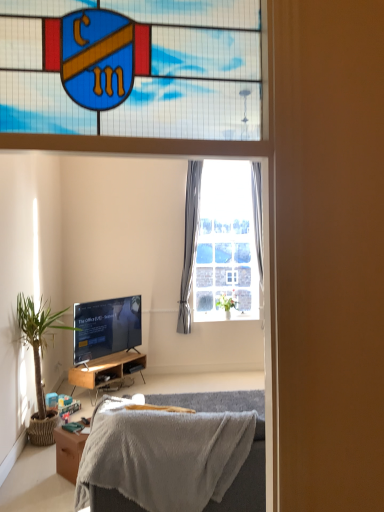
Question: Which direction should I rotate to look at gray fabric curtain at upper center, acting as the first curtain starting from the right, — up or down?

Choices:
 (A) up
 (B) down

Answer: (A)

Question: Is gray fabric curtain at upper center, acting as the first curtain starting from the right, next to matte black tv at lower left?

Choices:
 (A) yes
 (B) no

Answer: (B)

Question: Can you confirm if gray fabric curtain at upper center, the 2th curtain viewed from the left, is taller than matte black tv at lower left?

Choices:
 (A) yes
 (B) no

Answer: (A)

Question: From the image's perspective, is gray fabric curtain at upper center, the 2th curtain viewed from the left, located beneath matte black tv at lower left?

Choices:
 (A) no
 (B) yes

Answer: (A)

Question: Does gray fabric curtain at upper center, the 2th curtain viewed from the left, have a lesser height compared to matte black tv at lower left?

Choices:
 (A) yes
 (B) no

Answer: (B)

Question: Is gray fabric curtain at upper center, acting as the first curtain starting from the right, thinner than matte black tv at lower left?

Choices:
 (A) no
 (B) yes

Answer: (B)

Question: Considering the relative sizes of gray fabric curtain at upper center, the 2th curtain viewed from the left, and matte black tv at lower left in the image provided, is gray fabric curtain at upper center, the 2th curtain viewed from the left, smaller than matte black tv at lower left?

Choices:
 (A) no
 (B) yes

Answer: (B)

Question: Considering the relative sizes of soft gray blanket at lower center and wooden desk at lower left in the image provided, is soft gray blanket at lower center smaller than wooden desk at lower left?

Choices:
 (A) no
 (B) yes

Answer: (A)

Question: Can you confirm if soft gray blanket at lower center is wider than wooden desk at lower left?

Choices:
 (A) no
 (B) yes

Answer: (B)

Question: Is soft gray blanket at lower center far away from wooden desk at lower left?

Choices:
 (A) yes
 (B) no

Answer: (A)

Question: Does soft gray blanket at lower center come in front of wooden desk at lower left?

Choices:
 (A) yes
 (B) no

Answer: (A)

Question: Would you say soft gray blanket at lower center contains wooden desk at lower left?

Choices:
 (A) no
 (B) yes

Answer: (A)

Question: From the image's perspective, is soft gray blanket at lower center on wooden desk at lower left?

Choices:
 (A) no
 (B) yes

Answer: (B)

Question: From a real-world perspective, is green leafy plant at left, the 1th houseplant positioned from the front, over soft gray blanket at lower center?

Choices:
 (A) yes
 (B) no

Answer: (A)